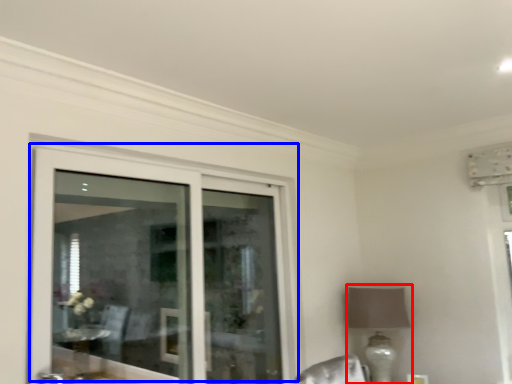
Question: Which point is further to the camera, table lamp (highlighted by a red box) or door (highlighted by a blue box)?

Choices:
 (A) table lamp
 (B) door

Answer: (A)